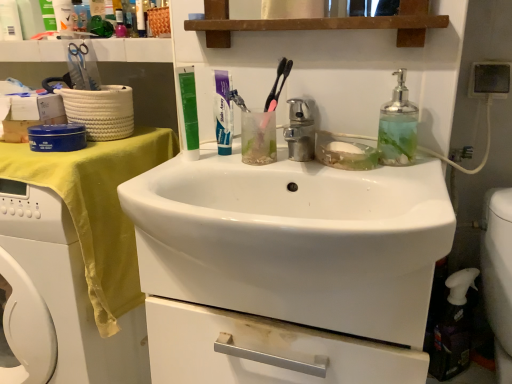
This screenshot has width=512, height=384. Find the location of `unoccupied region to the right of polished chrome faucet at center`. unoccupied region to the right of polished chrome faucet at center is located at coordinates (x=390, y=170).